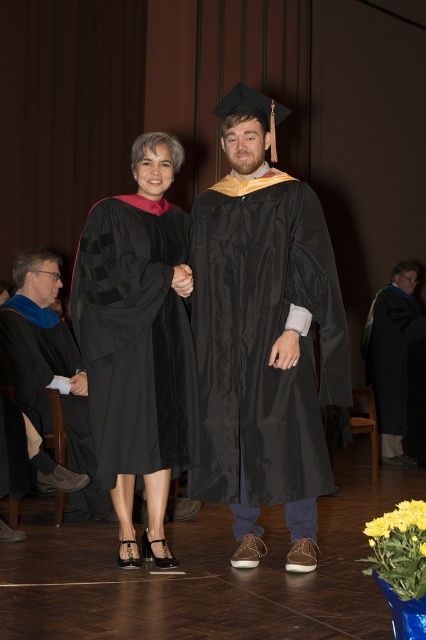
Does matte black graduation gown at center come behind matte black gown at center?

No, it is not.

This screenshot has height=640, width=426. What are the coordinates of `matte black graduation gown at center` in the screenshot? It's located at (264, 337).

What are the coordinates of `matte black graduation gown at center` in the screenshot? It's located at pos(264,337).

Who is higher up, matte black gown at center or matte black graduation gown at right?

matte black gown at center

Is matte black gown at center below matte black graduation gown at right?

Incorrect, matte black gown at center is not positioned below matte black graduation gown at right.

In order to click on matte black gown at center in this screenshot , I will do `click(138, 340)`.

Who is higher up, matte black graduation gown at center or matte black graduation gown at right?

matte black graduation gown at center is above.

Does point (285, 227) come closer to viewer compared to point (379, 326)?

Yes, it is in front of point (379, 326).

Identify the location of matte black graduation gown at center. This screenshot has height=640, width=426. (264, 337).